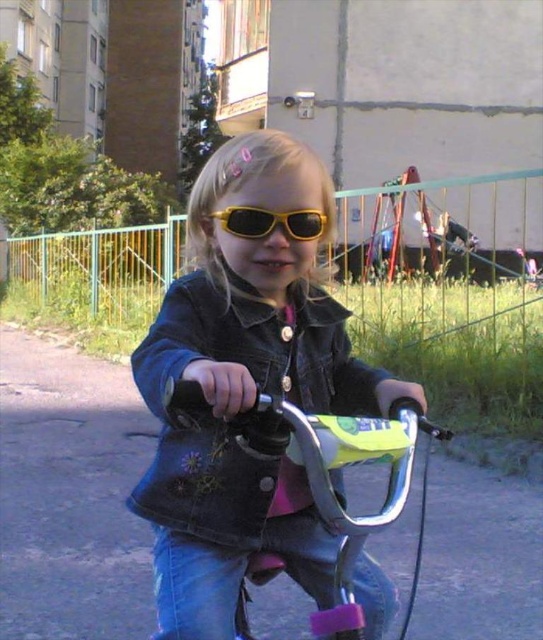
Is metallic silver bicycle handlebars at center bigger than shiny yellow sunglasses at center?

Yes.

Consider the image. Does metallic silver bicycle handlebars at center have a lesser width compared to shiny yellow sunglasses at center?

In fact, metallic silver bicycle handlebars at center might be wider than shiny yellow sunglasses at center.

At what (x,y) coordinates should I click in order to perform the action: click on metallic silver bicycle handlebars at center. Please return your answer as a coordinate pair (x, y). The image size is (543, 640). Looking at the image, I should click on (331, 481).

Does matte black jacket at center appear on the right side of shiny yellow sunglasses at center?

Yes, matte black jacket at center is to the right of shiny yellow sunglasses at center.

Can you confirm if matte black jacket at center is taller than shiny yellow sunglasses at center?

Yes, matte black jacket at center is taller than shiny yellow sunglasses at center.

Is point (377, 397) less distant than point (313, 230)?

No, (377, 397) is behind (313, 230).

Image resolution: width=543 pixels, height=640 pixels. I want to click on matte black jacket at center, so click(245, 388).

Who is positioned more to the right, matte black jacket at center or metallic silver bicycle handlebars at center?

metallic silver bicycle handlebars at center

What do you see at coordinates (245, 388) in the screenshot? This screenshot has height=640, width=543. I see `matte black jacket at center` at bounding box center [245, 388].

Which is behind, point (243, 193) or point (352, 630)?

The point (243, 193) is behind.

Locate an element on the screen. matte black jacket at center is located at coordinates (245, 388).